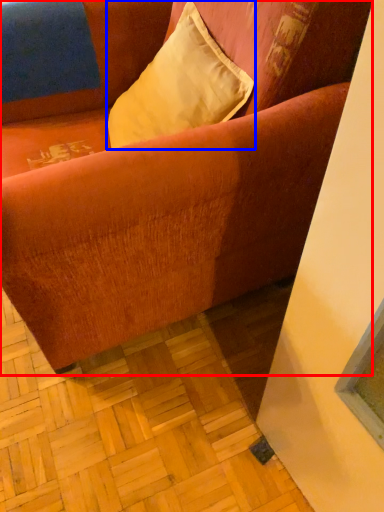
Question: Among these objects, which one is farthest to the camera, studio couch (highlighted by a red box) or pillow (highlighted by a blue box)?

Choices:
 (A) studio couch
 (B) pillow

Answer: (B)